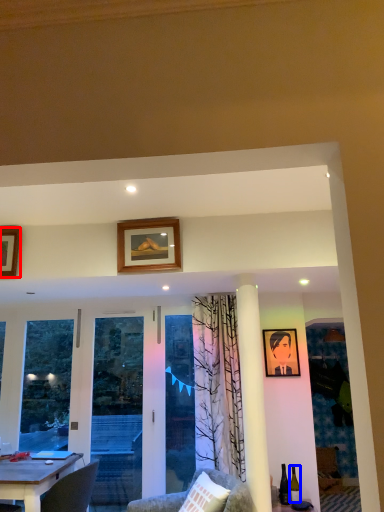
Question: Among these objects, which one is farthest to the camera, picture frame (highlighted by a red box) or wine bottle (highlighted by a blue box)?

Choices:
 (A) picture frame
 (B) wine bottle

Answer: (B)